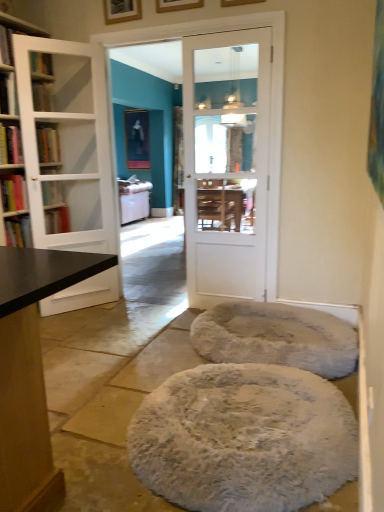
Where is `free point above white glossy door at center, which ranks as the second door in left-to-right order (from a real-world perspective)`? The width and height of the screenshot is (384, 512). free point above white glossy door at center, which ranks as the second door in left-to-right order (from a real-world perspective) is located at coordinates (226, 32).